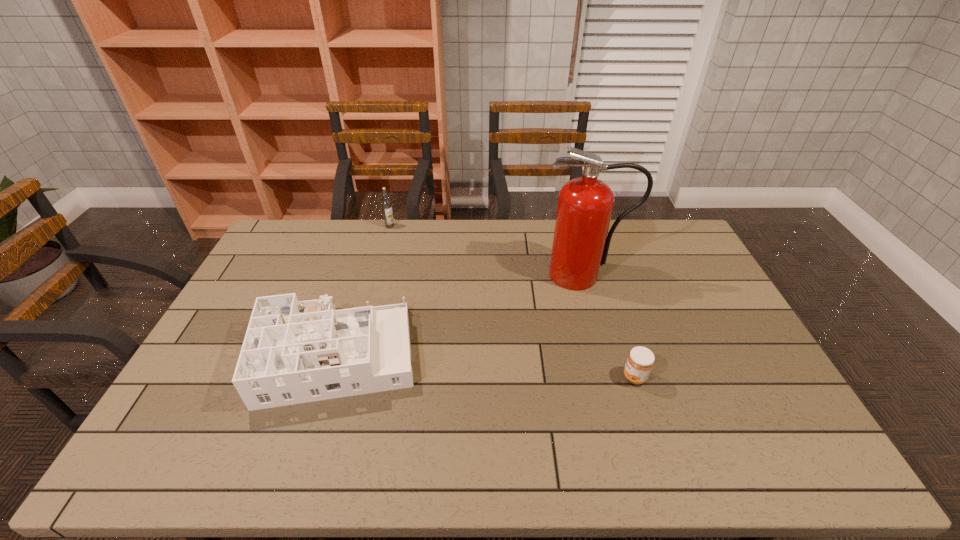
Where is `the second farthest object`? The width and height of the screenshot is (960, 540). the second farthest object is located at coordinates (580, 245).

Find the location of a particular element. the tallest object is located at coordinates (580, 245).

At what (x,y) coordinates should I click in order to perform the action: click on the farthest object. Please return your answer as a coordinate pair (x, y). The width and height of the screenshot is (960, 540). Looking at the image, I should click on (386, 203).

This screenshot has width=960, height=540. Identify the location of the second tallest object. (386, 203).

You are a GUI agent. You are given a task and a screenshot of the screen. Output one action in this format:
    pyautogui.click(x=<x>, y=<y>)
    Task: Click on the dollhouse
    This screenshot has width=960, height=540.
    Given the screenshot: What is the action you would take?
    pyautogui.click(x=294, y=352)

Where is `the shortest object`? This screenshot has height=540, width=960. the shortest object is located at coordinates (640, 361).

Where is `vacant position located 0.250m with the handle and nozzle on the fire extinguisher`? The height and width of the screenshot is (540, 960). vacant position located 0.250m with the handle and nozzle on the fire extinguisher is located at coordinates (604, 349).

This screenshot has width=960, height=540. What are the coordinates of `vacant point located 0.180m on the label of the farthest object` in the screenshot? It's located at (381, 257).

You are a GUI agent. You are given a task and a screenshot of the screen. Output one action in this format:
    pyautogui.click(x=<x>, y=<y>)
    Task: Click on the vacant region located on the back of the dollhouse
    The image size is (960, 540).
    Given the screenshot: What is the action you would take?
    pyautogui.click(x=362, y=275)

Locate an element on the screen. The height and width of the screenshot is (540, 960). vacant area located 0.380m on the front label of the jam is located at coordinates [x=484, y=377].